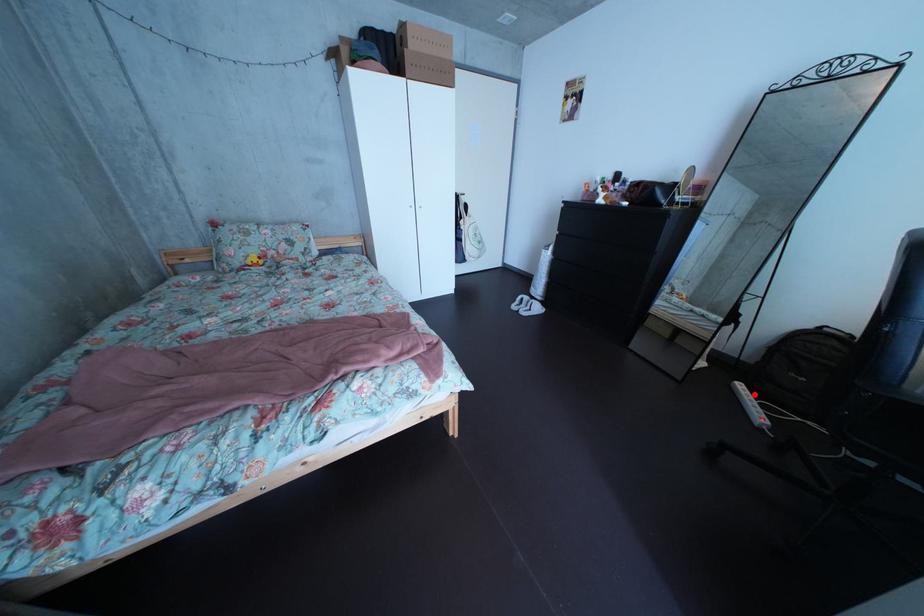
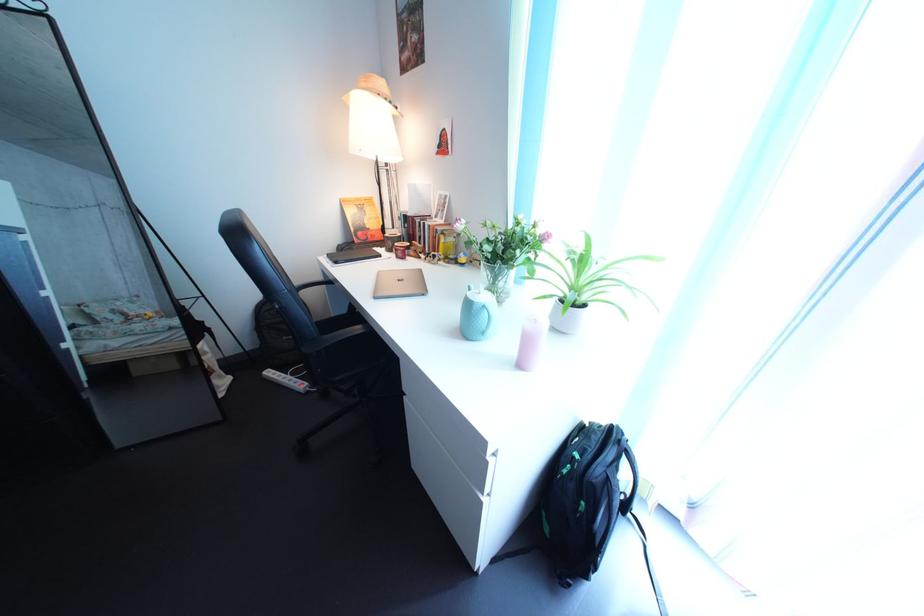
Question: I am providing you with two images of the same scene from different viewpoints. A red point is marked on the first image. Can you still see the location of the red point in image 2?

Choices:
 (A) Yes
 (B) No

Answer: (A)